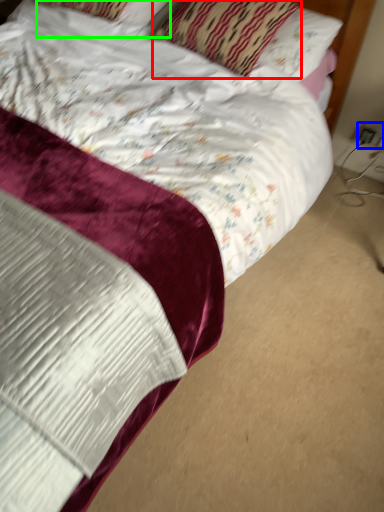
Question: Estimate the real-world distances between objects in this image. Which object is farther from pillow (highlighted by a red box), electric outlet (highlighted by a blue box) or pillow (highlighted by a green box)?

Choices:
 (A) electric outlet
 (B) pillow

Answer: (A)